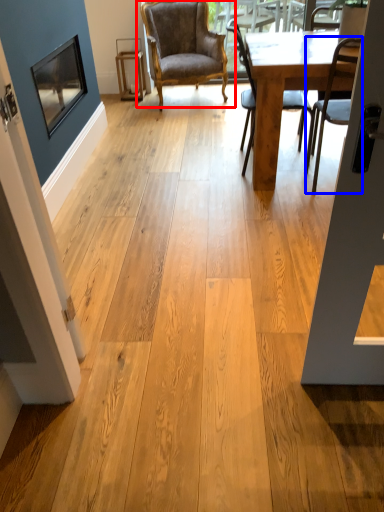
Question: Which object is further to the camera taking this photo, chair (highlighted by a red box) or chair (highlighted by a blue box)?

Choices:
 (A) chair
 (B) chair

Answer: (A)